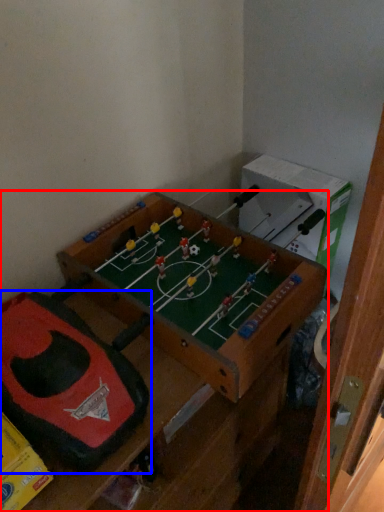
Question: Which of the following is the farthest to the observer, furniture (highlighted by a red box) or toy (highlighted by a blue box)?

Choices:
 (A) furniture
 (B) toy

Answer: (B)